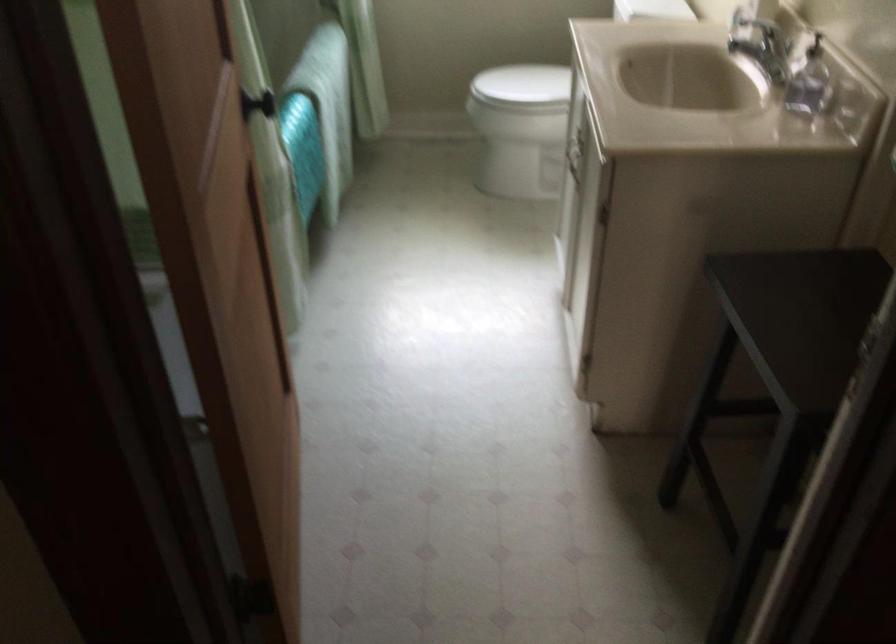
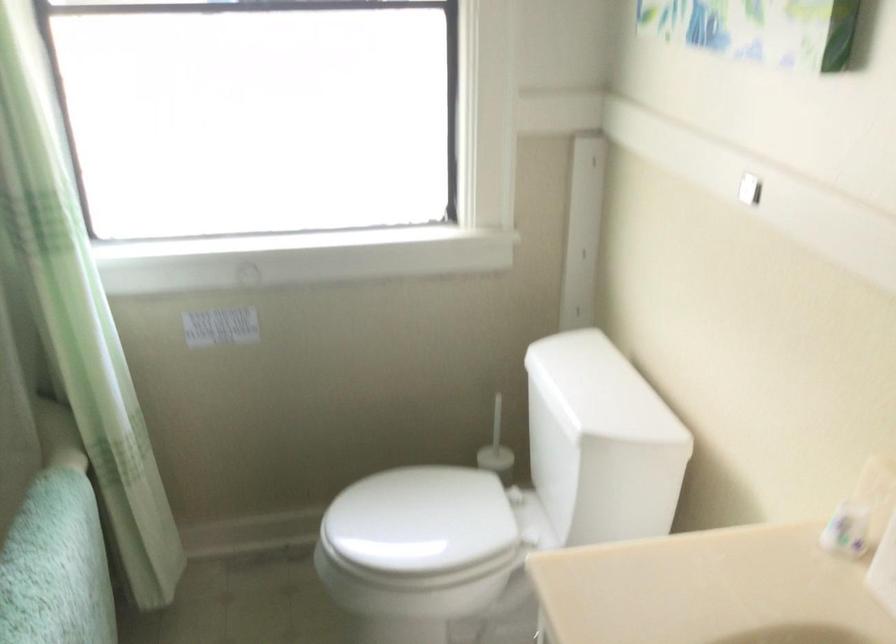
Question: What movement of the cameraman would produce the second image?

Choices:
 (A) Left
 (B) Right
 (C) Forward
 (D) Backward

Answer: (C)